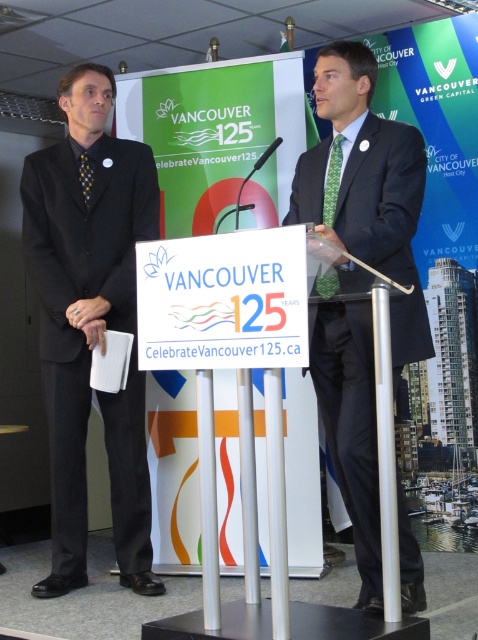
Does point (123, 253) come behind point (368, 420)?

That is True.

Can you confirm if black suit at left is positioned to the left of matte black suit at center?

Correct, you'll find black suit at left to the left of matte black suit at center.

The width and height of the screenshot is (478, 640). What are the coordinates of `black suit at left` in the screenshot? It's located at (82, 284).